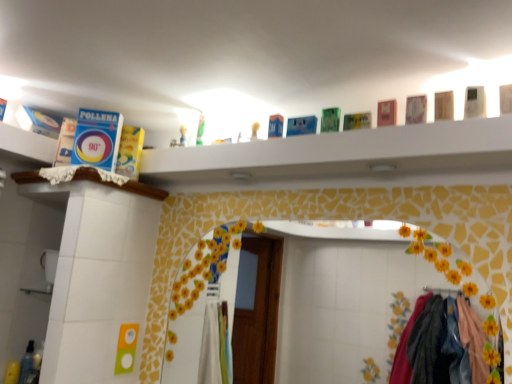
At what (x,y) coordinates should I click in order to perform the action: click on vacant area on top of white mosaic mirror at center (from a real-world perspective). Please return your answer as a coordinate pair (x, y). This screenshot has width=512, height=384. Looking at the image, I should click on (316, 189).